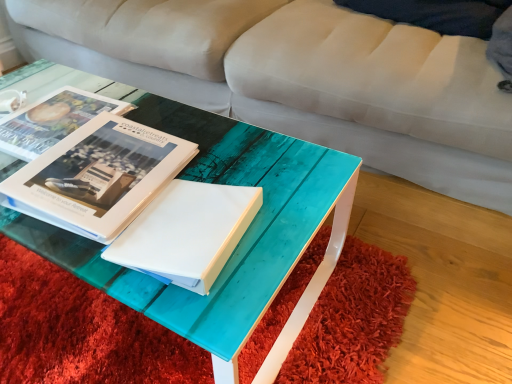
Question: Can you confirm if teal glossy wood coffee table at center is positioned to the right of translucent teal table at center?

Choices:
 (A) no
 (B) yes

Answer: (A)

Question: Does teal glossy wood coffee table at center have a smaller size compared to translucent teal table at center?

Choices:
 (A) yes
 (B) no

Answer: (B)

Question: Is translucent teal table at center inside teal glossy wood coffee table at center?

Choices:
 (A) no
 (B) yes

Answer: (B)

Question: From a real-world perspective, is teal glossy wood coffee table at center located beneath translucent teal table at center?

Choices:
 (A) yes
 (B) no

Answer: (A)

Question: Does teal glossy wood coffee table at center have a lesser width compared to translucent teal table at center?

Choices:
 (A) yes
 (B) no

Answer: (B)

Question: Is teal glossy wood coffee table at center positioned beyond the bounds of translucent teal table at center?

Choices:
 (A) yes
 (B) no

Answer: (A)

Question: Is translucent teal table at center positioned beyond the bounds of white matte paper at center?

Choices:
 (A) yes
 (B) no

Answer: (A)

Question: Can you confirm if translucent teal table at center is shorter than white matte paper at center?

Choices:
 (A) no
 (B) yes

Answer: (B)

Question: Could white matte paper at center be considered to be inside translucent teal table at center?

Choices:
 (A) yes
 (B) no

Answer: (B)

Question: Is white matte paper at center at the back of translucent teal table at center?

Choices:
 (A) no
 (B) yes

Answer: (A)

Question: Does translucent teal table at center lie in front of white matte paper at center?

Choices:
 (A) yes
 (B) no

Answer: (A)

Question: Is translucent teal table at center taller than white matte paper at center?

Choices:
 (A) yes
 (B) no

Answer: (B)

Question: Would you say matte white book at center, which appears as the second book when viewed from the back, is outside translucent teal table at center?

Choices:
 (A) yes
 (B) no

Answer: (A)